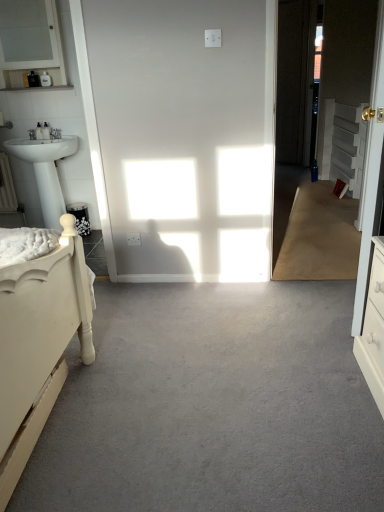
Question: From the image's perspective, relative to gray carpet at center, is white textured cabinet at right above or below?

Choices:
 (A) below
 (B) above

Answer: (B)

Question: Based on their positions, is white textured cabinet at right located to the left or right of gray carpet at center?

Choices:
 (A) right
 (B) left

Answer: (A)

Question: Which object is positioned closest to the white textured cabinet at right?

Choices:
 (A) gray carpet at center
 (B) matte white cabinet at upper left
 (C) white glossy pedestal sink at left
 (D) white glossy door at right

Answer: (D)

Question: Which object is the closest to the white textured cabinet at right?

Choices:
 (A) matte white cabinet at upper left
 (B) gray carpet at center
 (C) white glossy pedestal sink at left
 (D) white glossy door at right

Answer: (D)